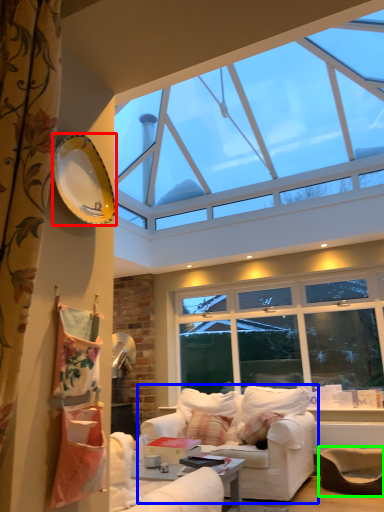
Question: Estimate the real-world distances between objects in this image. Which object is farther from plate (highlighted by a red box), studio couch (highlighted by a blue box) or armchair (highlighted by a green box)?

Choices:
 (A) studio couch
 (B) armchair

Answer: (B)